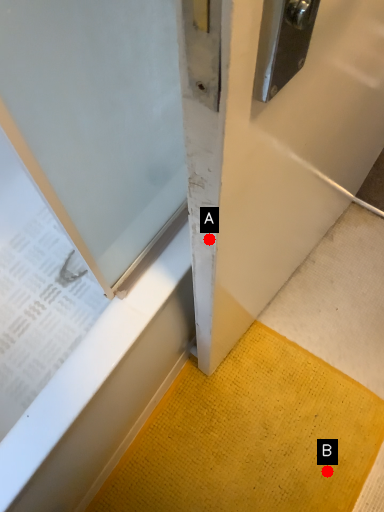
Question: Two points are circled on the image, labeled by A and B beside each circle. Which of the following is the closest to the observer?

Choices:
 (A) A is closer
 (B) B is closer

Answer: (A)